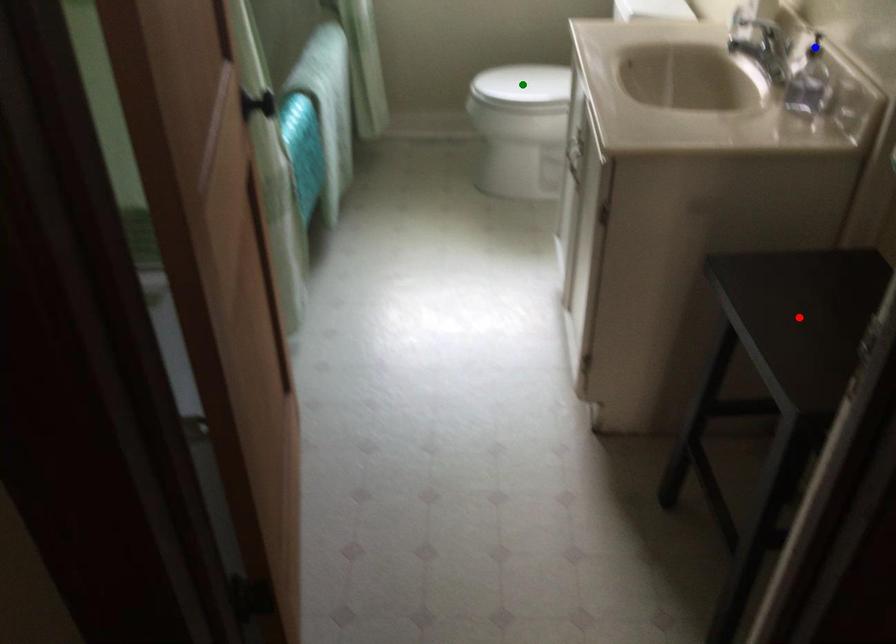
Order these from nearest to farthest:
red point | green point | blue point

red point < blue point < green point